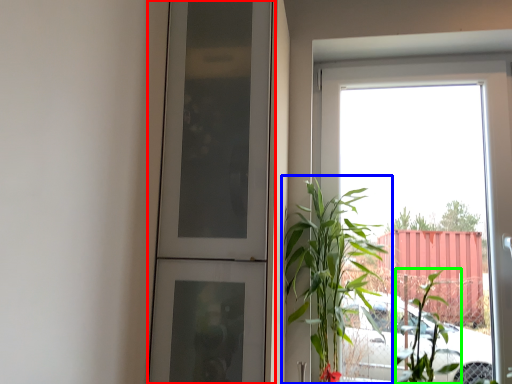
Question: Considering the real-world distances, which object is closest to door (highlighted by a red box)? houseplant (highlighted by a blue box) or plant (highlighted by a green box).

Choices:
 (A) houseplant
 (B) plant

Answer: (A)